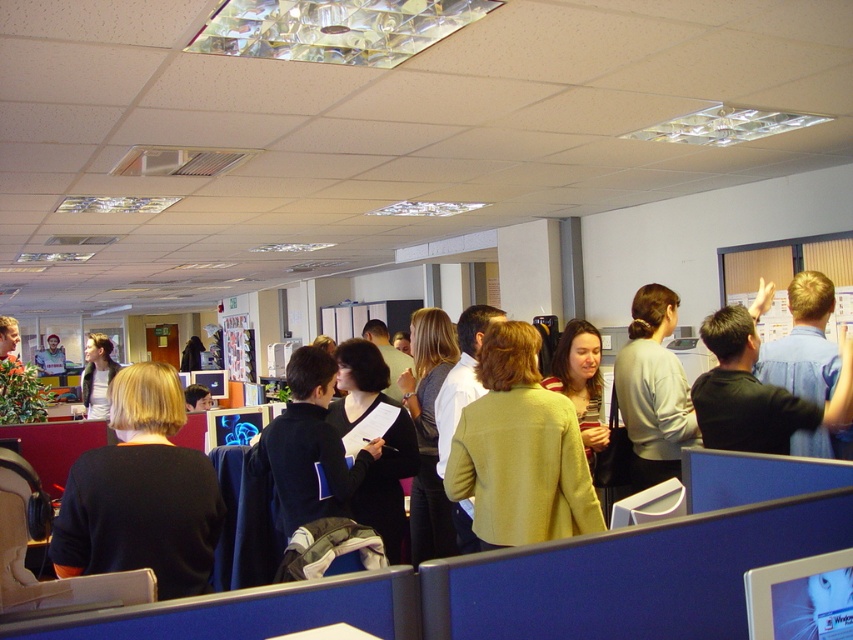
Is dark blue sweater at center wider than light brown hair at center?

In fact, dark blue sweater at center might be narrower than light brown hair at center.

Does point (152, 385) come farther from viewer compared to point (93, 380)?

No, it is in front of (93, 380).

Locate an element on the screen. Image resolution: width=853 pixels, height=640 pixels. dark blue sweater at center is located at coordinates (141, 492).

Is point (660, 392) farther from camera compared to point (103, 340)?

No, (660, 392) is in front of (103, 340).

In the scene shown: Who is positioned more to the left, light gray sweater at center or light brown hair at center?

light brown hair at center

Does point (682, 406) lie in front of point (83, 369)?

Yes, it is in front of point (83, 369).

Locate an element on the screen. This screenshot has height=640, width=853. light gray sweater at center is located at coordinates point(653,388).

Does point (625, 400) come behind point (830, 308)?

Yes, it is behind point (830, 308).

Who is more distant from viewer, [659,448] or [798,292]?

The point [659,448] is more distant.

Which is behind, point (631, 362) or point (805, 320)?

Positioned behind is point (631, 362).

You are a GUI agent. You are given a task and a screenshot of the screen. Output one action in this format:
    pyautogui.click(x=<x>, y=<y>)
    Task: Click on the light gray sweater at center
    
    Given the screenshot: What is the action you would take?
    pyautogui.click(x=653, y=388)